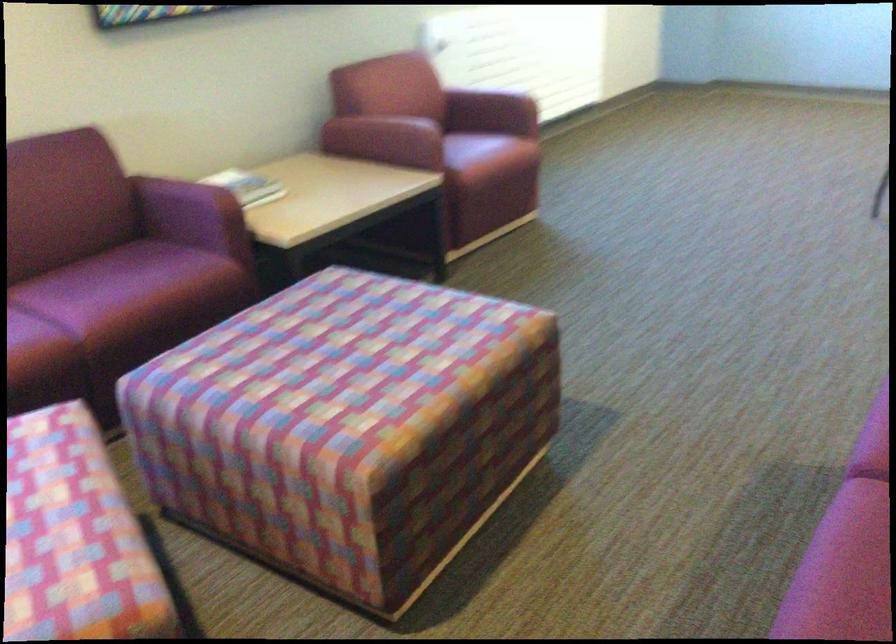
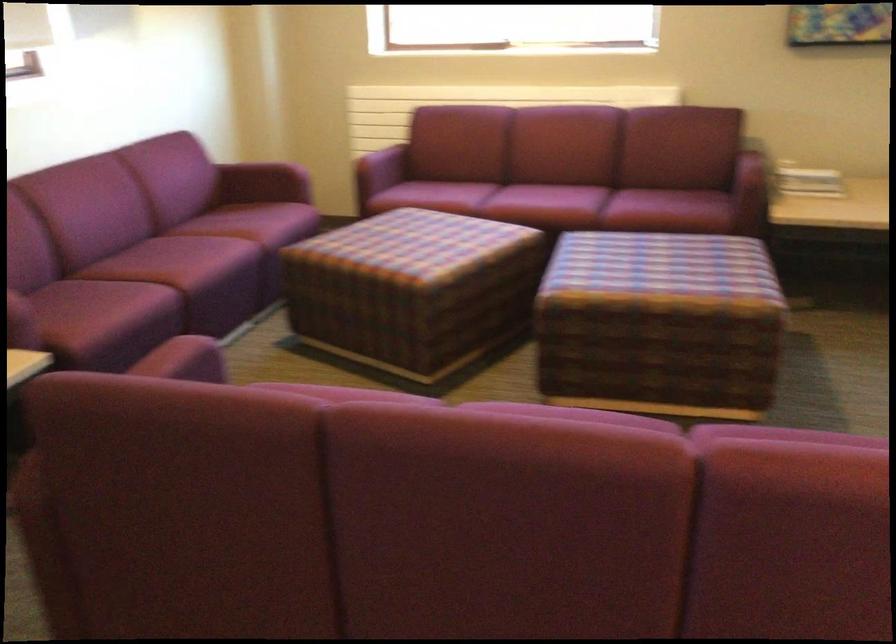
Find the pixel in the second image that matches pixel 176 290 in the first image.

(668, 211)